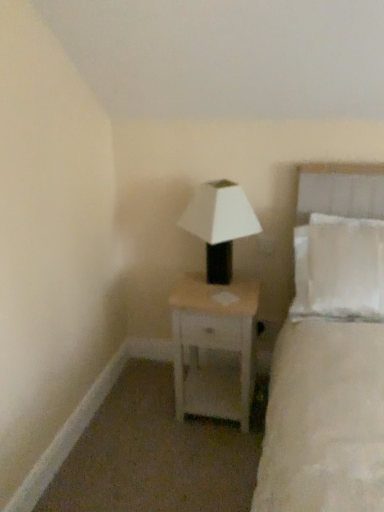
Question: Is white fabric bed at right oriented towards white matte nightstand at center?

Choices:
 (A) yes
 (B) no

Answer: (B)

Question: Considering the relative positions of white fabric bed at right and white matte nightstand at center in the image provided, is white fabric bed at right to the right of white matte nightstand at center from the viewer's perspective?

Choices:
 (A) yes
 (B) no

Answer: (A)

Question: From the image's perspective, is white fabric bed at right beneath white matte nightstand at center?

Choices:
 (A) yes
 (B) no

Answer: (B)

Question: Is white fabric bed at right smaller than white matte nightstand at center?

Choices:
 (A) no
 (B) yes

Answer: (A)

Question: Is white fabric bed at right in front of white matte nightstand at center?

Choices:
 (A) no
 (B) yes

Answer: (B)

Question: Is point (218, 181) positioned closer to the camera than point (362, 265)?

Choices:
 (A) farther
 (B) closer

Answer: (A)

Question: Considering their positions, is white matte lamp at center located in front of or behind white fabric bed at right?

Choices:
 (A) front
 (B) behind

Answer: (B)

Question: In terms of width, does white matte lamp at center look wider or thinner when compared to white fabric bed at right?

Choices:
 (A) wide
 (B) thin

Answer: (B)

Question: In terms of size, does white matte lamp at center appear bigger or smaller than white fabric bed at right?

Choices:
 (A) small
 (B) big

Answer: (A)

Question: Considering the positions of point (342, 210) and point (198, 192), is point (342, 210) closer or farther from the camera than point (198, 192)?

Choices:
 (A) closer
 (B) farther

Answer: (B)

Question: In terms of size, does white fabric bed at right appear bigger or smaller than white matte lamp at center?

Choices:
 (A) small
 (B) big

Answer: (B)

Question: From the image's perspective, relative to white matte lamp at center, is white fabric bed at right above or below?

Choices:
 (A) below
 (B) above

Answer: (A)

Question: Is white fabric bed at right situated inside white matte lamp at center or outside?

Choices:
 (A) inside
 (B) outside

Answer: (B)

Question: Is point (198, 380) closer or farther from the camera than point (198, 221)?

Choices:
 (A) farther
 (B) closer

Answer: (A)

Question: From the image's perspective, is white matte nightstand at center located above or below white matte lamp at center?

Choices:
 (A) above
 (B) below

Answer: (B)